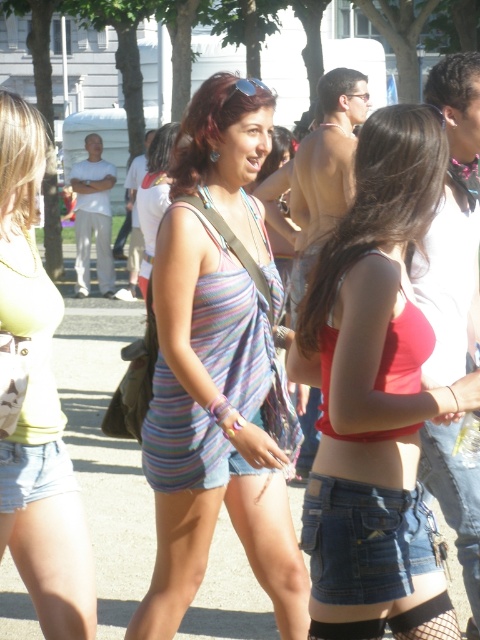
Is point (176, 476) farther from camera compared to point (372, 492)?

Yes, it is.

Who is positioned more to the right, striped fabric dress at center or denim at lower center?

From the viewer's perspective, denim at lower center appears more on the right side.

Which is behind, point (282, 580) or point (315, 573)?

The point (282, 580) is more distant.

You are a GUI agent. You are given a task and a screenshot of the screen. Output one action in this format:
    pyautogui.click(x=<x>, y=<y>)
    Task: Click on the striped fabric dress at center
    
    Given the screenshot: What is the action you would take?
    pyautogui.click(x=218, y=371)

Is matte red tank top at center bigger than matte yellow tank top at center?

Correct, matte red tank top at center is larger in size than matte yellow tank top at center.

Who is positioned more to the left, matte red tank top at center or matte yellow tank top at center?

From the viewer's perspective, matte yellow tank top at center appears more on the left side.

Which is in front, point (324, 435) or point (4, 460)?

Point (324, 435) is more forward.

The width and height of the screenshot is (480, 640). What are the coordinates of `matte red tank top at center` in the screenshot? It's located at (375, 396).

What do you see at coordinates (218, 371) in the screenshot? This screenshot has width=480, height=640. I see `striped fabric dress at center` at bounding box center [218, 371].

Does striped fabric dress at center have a larger size compared to matte red tank top at center?

Indeed, striped fabric dress at center has a larger size compared to matte red tank top at center.

Is point (159, 324) positioned before point (338, 419)?

No, (159, 324) is behind (338, 419).

This screenshot has width=480, height=640. I want to click on striped fabric dress at center, so click(x=218, y=371).